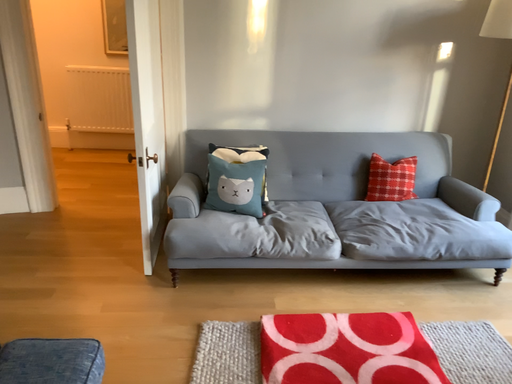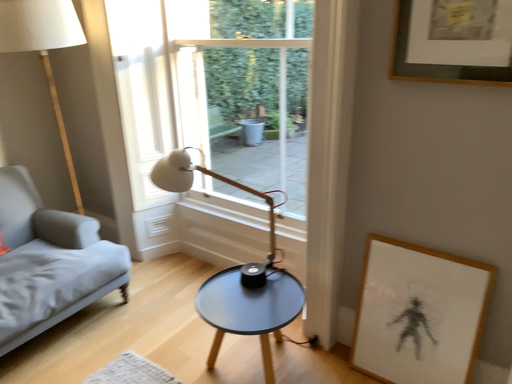
Question: How did the camera likely rotate when shooting the video?

Choices:
 (A) rotated right
 (B) rotated left

Answer: (A)